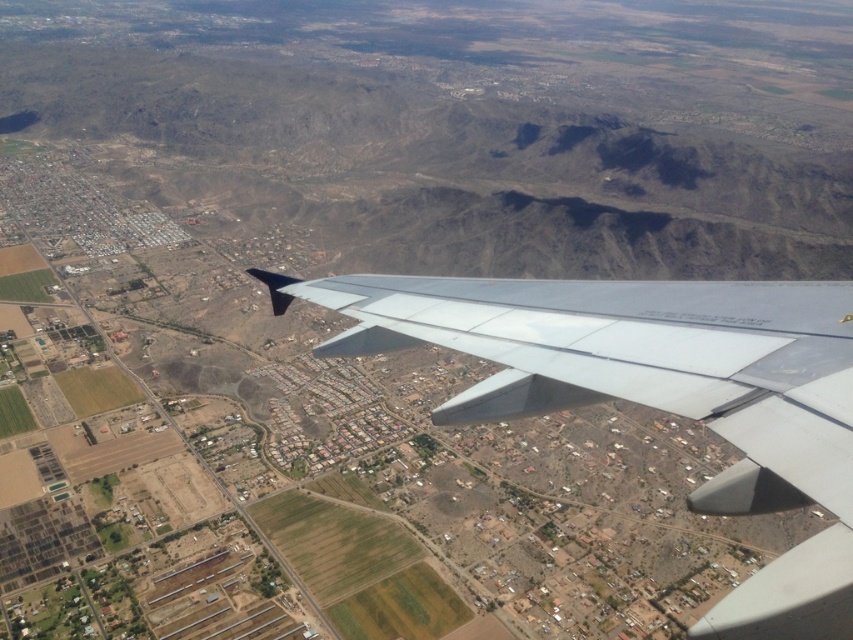
You are a passenger sitting by the window and want to take a photo of the landscape below. However, the airplane has two wings blocking your view. Which wing, the metallic gray wing at center or the silver metallic wing at center, is closer to you and thus more obstructive?

The metallic gray wing at center is in front of the silver metallic wing at center, making it closer to you and more obstructive.

You are a pilot looking at the landscape through the airplane window. You notice two points on the terrain below, labeled as point (506, 305) and point (581, 298). Which of these points is closer to the airplane?

Point (506, 305) is further to the viewer than point (581, 298), so the point closer to the airplane is point (581, 298).

You are a pilot checking the aircraft configuration before takeoff. You notice two wings at the center of your view. According to the aircraft manual, the left wing should be taller than the right one. Which of the two wings, the metallic gray wing at center or the silver metallic wing at center, should you confirm matches the manual?

The metallic gray wing at center has a greater height compared to the silver metallic wing at center, so it should be the one that matches the manual requirement of the left wing being taller.